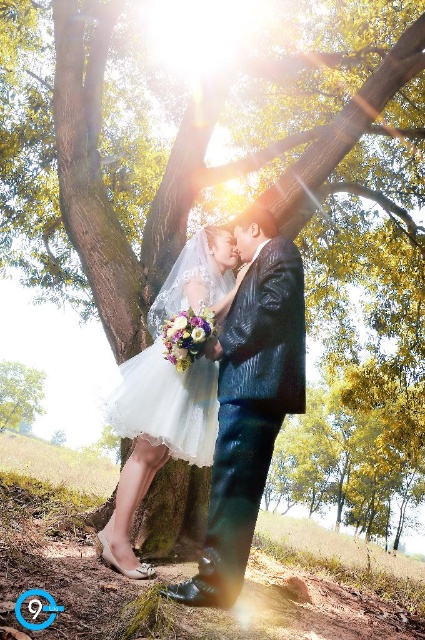
You are a photographer setting up for a wedding photo. You have a matte white dress at center and a green leafy tree at lower left in the scene. Which object takes up more space in the image?

The green leafy tree at lower left occupies more space in the image than the matte white dress at center.

You are a photographer at the wedding and want to position a spotlight on the shiny dark blue suit at center and the matte white dress at center. Since the spotlight can only cover one side, which side should you choose to best highlight both? Explain your reasoning based on their positions.

The shiny dark blue suit at center is to the right of the matte white dress at center. To best highlight both, the spotlight should be positioned on the right side so that it can cover the shiny dark blue suit at center and also illuminate the matte white dress at center which is to the left of it.

You are a photographer standing in front of the shiny dark blue suit at center and the green leafy tree at lower left. Which object is nearer to you?

The shiny dark blue suit at center is closer to the viewer than the green leafy tree at lower left.